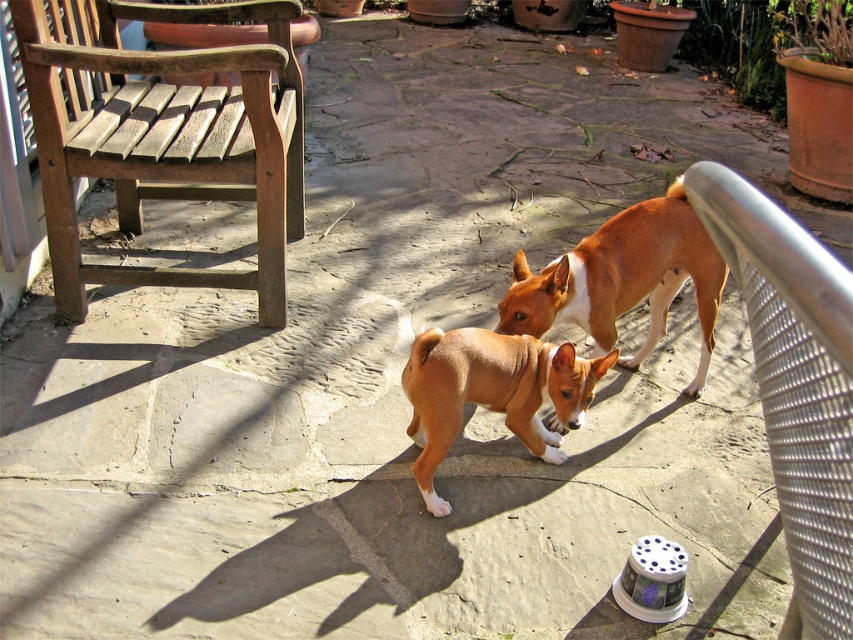
Question: Which point is farther to the camera?

Choices:
 (A) brown furry dog at center
 (B) brown smooth dog at center

Answer: (B)

Question: Which of the following is the farthest from the observer?

Choices:
 (A) brown smooth dog at center
 (B) silver metallic rail at upper right

Answer: (A)

Question: Can you confirm if silver metallic rail at upper right is thinner than brown furry dog at center?

Choices:
 (A) yes
 (B) no

Answer: (A)

Question: Is silver metallic rail at upper right positioned in front of brown smooth dog at center?

Choices:
 (A) yes
 (B) no

Answer: (A)

Question: Which of the following is the closest to the observer?

Choices:
 (A) (576, 323)
 (B) (827, 556)
 (C) (421, 492)

Answer: (B)

Question: Is silver metallic rail at upper right wider than brown smooth dog at center?

Choices:
 (A) no
 (B) yes

Answer: (A)